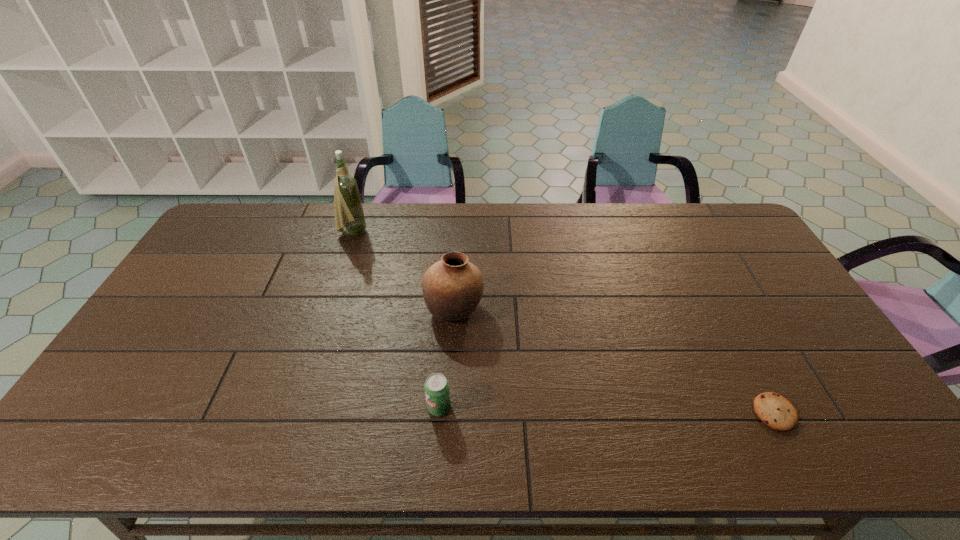
The width and height of the screenshot is (960, 540). I want to click on blank space located 0.190m on the right of the shortest object, so click(x=873, y=413).

Locate an element on the screen. Image resolution: width=960 pixels, height=540 pixels. object located at the far edge is located at coordinates (348, 209).

At what (x,y) coordinates should I click in order to perform the action: click on object present at the near edge. Please return your answer as a coordinate pair (x, y). The height and width of the screenshot is (540, 960). Looking at the image, I should click on (774, 410).

Identify the location of vacant area at the far edge of the desktop. (647, 216).

Image resolution: width=960 pixels, height=540 pixels. Identify the location of free space at the near edge of the desktop. (605, 453).

Locate an element on the screen. This screenshot has width=960, height=540. vacant area at the left edge is located at coordinates (211, 251).

Find the location of a particular element. vacant region at the right edge of the desktop is located at coordinates (762, 300).

Locate an element on the screen. vacant space at the far right corner of the desktop is located at coordinates (742, 238).

This screenshot has width=960, height=540. I want to click on free space between the second farthest object and the cookie, so click(614, 361).

This screenshot has width=960, height=540. In order to click on vacant region between the cookie and the farthest object in this screenshot , I will do `click(564, 322)`.